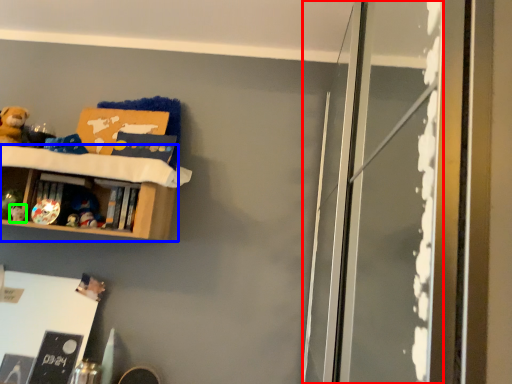
Question: Which object is positioned farthest from screen door (highlighted by a red box)? Select from shelf (highlighted by a blue box) and toy (highlighted by a green box).

Choices:
 (A) shelf
 (B) toy

Answer: (B)